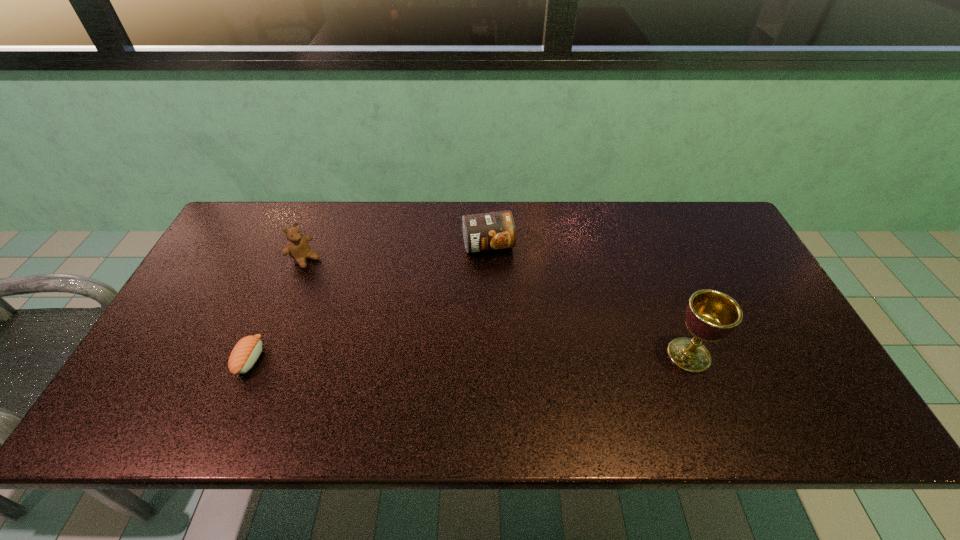
The width and height of the screenshot is (960, 540). Identify the location of free location located on the front label of the can. (513, 326).

Image resolution: width=960 pixels, height=540 pixels. Find the location of `vacant region located 0.220m on the front label of the can`. vacant region located 0.220m on the front label of the can is located at coordinates (510, 317).

Locate an element on the screen. free spot located 0.100m on the front label of the can is located at coordinates (500, 285).

Locate an element on the screen. This screenshot has width=960, height=540. teddy bear that is at the far edge is located at coordinates tap(298, 248).

You are a GUI agent. You are given a task and a screenshot of the screen. Output one action in this format:
    pyautogui.click(x=<x>, y=<y>)
    Task: Click on the can that is positioned at the far edge
    
    Given the screenshot: What is the action you would take?
    pyautogui.click(x=489, y=231)

You are a GUI agent. You are given a task and a screenshot of the screen. Output one action in this format:
    pyautogui.click(x=<x>, y=<y>)
    Task: Click on the sushi located in the near edge section of the desktop
    This screenshot has width=960, height=540.
    Given the screenshot: What is the action you would take?
    pyautogui.click(x=245, y=353)

The image size is (960, 540). I want to click on chalice present at the near edge, so click(711, 315).

The height and width of the screenshot is (540, 960). In order to click on vacant space at the far edge of the desktop in this screenshot , I will do `click(614, 247)`.

In order to click on vacant region at the near edge of the desktop in this screenshot , I will do `click(468, 392)`.

What are the coordinates of `vacant space at the left edge of the desktop` in the screenshot? It's located at (246, 299).